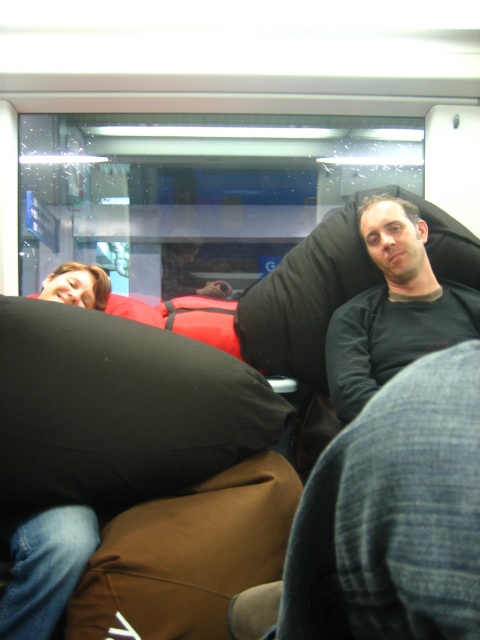
Who is more forward, (216,449) or (284,513)?

Point (284,513) is in front.

Can you confirm if black fabric pillow at left is shorter than brown fabric bean bag chair at center?

No.

Is point (135, 406) behind point (223, 512)?

Yes, point (135, 406) is behind point (223, 512).

Where is `black fabric pillow at left`? The height and width of the screenshot is (640, 480). black fabric pillow at left is located at coordinates (118, 408).

Is point (128, 465) closer to viewer compared to point (396, 342)?

That is True.

Does black fabric pillow at left have a smaller size compared to black matte shirt at upper right?

Incorrect, black fabric pillow at left is not smaller in size than black matte shirt at upper right.

Where is `black fabric pillow at left`? The image size is (480, 640). black fabric pillow at left is located at coordinates (118, 408).

Does brown fabric bean bag chair at center come behind black matte shirt at upper right?

That is False.

Does brown fabric bean bag chair at center have a smaller size compared to black matte shirt at upper right?

Correct, brown fabric bean bag chair at center occupies less space than black matte shirt at upper right.

Who is more distant from viewer, [148,529] or [340,342]?

The point [340,342] is behind.

At what (x,y) coordinates should I click in order to perform the action: click on brown fabric bean bag chair at center. Please return your answer as a coordinate pair (x, y). This screenshot has width=480, height=640. Looking at the image, I should click on (189, 554).